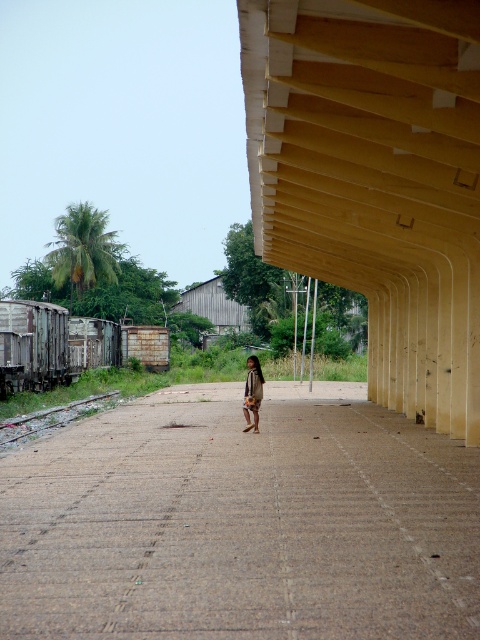
Question: Can you confirm if rusty metal train track at lower left is bigger than wooden hut at center?

Choices:
 (A) no
 (B) yes

Answer: (A)

Question: Does brown textured pavement at center have a larger size compared to wooden hut at center?

Choices:
 (A) yes
 (B) no

Answer: (B)

Question: Which of the following is the farthest from the observer?

Choices:
 (A) rusty metal train track at lower left
 (B) wooden hut at center

Answer: (B)

Question: Which object is positioned closest to the brown textured shirt at center?

Choices:
 (A) brown textured pavement at center
 (B) rusty metal train track at lower left

Answer: (A)

Question: Does brown textured pavement at center appear on the right side of wooden hut at center?

Choices:
 (A) no
 (B) yes

Answer: (B)

Question: Which object is farther from the camera taking this photo?

Choices:
 (A) brown textured shirt at center
 (B) yellow wood shelter at center

Answer: (A)